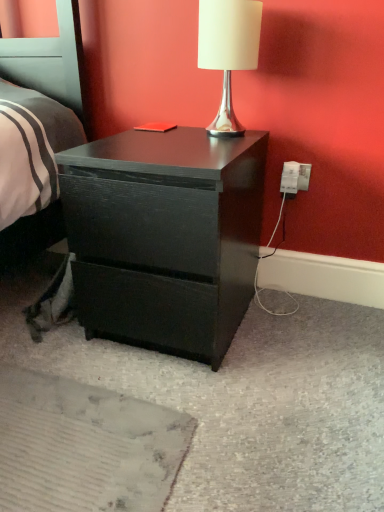
Where is `vacant region to the right of matte black nightstand at center`? Image resolution: width=384 pixels, height=512 pixels. vacant region to the right of matte black nightstand at center is located at coordinates (305, 335).